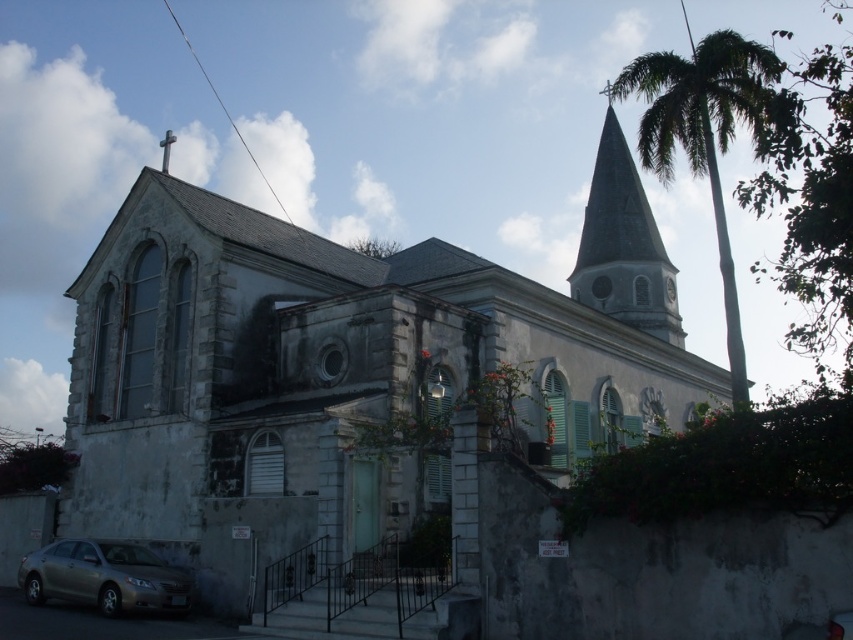
Question: Is the position of green leafy palm tree at upper right more distant than that of metallic silver sedan at lower left?

Choices:
 (A) yes
 (B) no

Answer: (B)

Question: Which point appears closest to the camera in this image?

Choices:
 (A) (26, 566)
 (B) (102, 461)

Answer: (A)

Question: Which object is positioned farthest from the green leafy palm tree at upper right?

Choices:
 (A) metallic silver sedan at lower left
 (B) white stone clock at upper center
 (C) smooth gray steeple at upper right

Answer: (A)

Question: Which point is farther to the camera?

Choices:
 (A) white stone clock at upper center
 (B) green leafy palm tree at upper right
 (C) metallic silver sedan at lower left
 (D) gray stone church at center

Answer: (A)

Question: Considering the relative positions of gray stone church at center and green leafy palm tree at upper right in the image provided, where is gray stone church at center located with respect to green leafy palm tree at upper right?

Choices:
 (A) right
 (B) left

Answer: (B)

Question: Does green leafy palm tree at upper right lie behind smooth gray steeple at upper right?

Choices:
 (A) no
 (B) yes

Answer: (A)